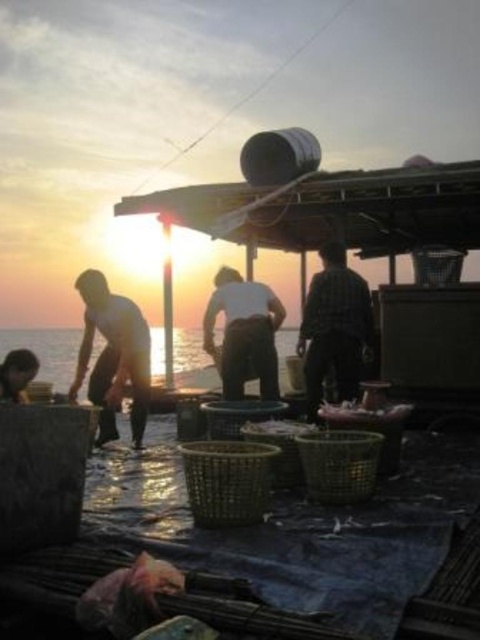
Question: Is smooth brown skin at lower left closer to camera compared to shiny silver fish at lower center?

Choices:
 (A) yes
 (B) no

Answer: (B)

Question: Which of the following is the farthest from the observer?

Choices:
 (A) silhouette fabric fisherman at center
 (B) smooth brown skin at lower left
 (C) flannel shirt at center
 (D) transparent plastic water at lower left

Answer: (A)

Question: Does silhouette skin fisherman at left have a larger size compared to flannel shirt at center?

Choices:
 (A) no
 (B) yes

Answer: (A)

Question: Is smooth brown skin at lower left smaller than shiny silver fish at lower center?

Choices:
 (A) yes
 (B) no

Answer: (B)

Question: Among these points, which one is nearest to the camera?

Choices:
 (A) (314, 282)
 (B) (32, 358)
 (C) (184, 358)

Answer: (B)

Question: Which of the following is the farthest from the observer?

Choices:
 (A) flannel shirt at center
 (B) silhouette skin fisherman at left
 (C) smooth brown skin at lower left
 (D) transparent plastic water at lower left

Answer: (D)